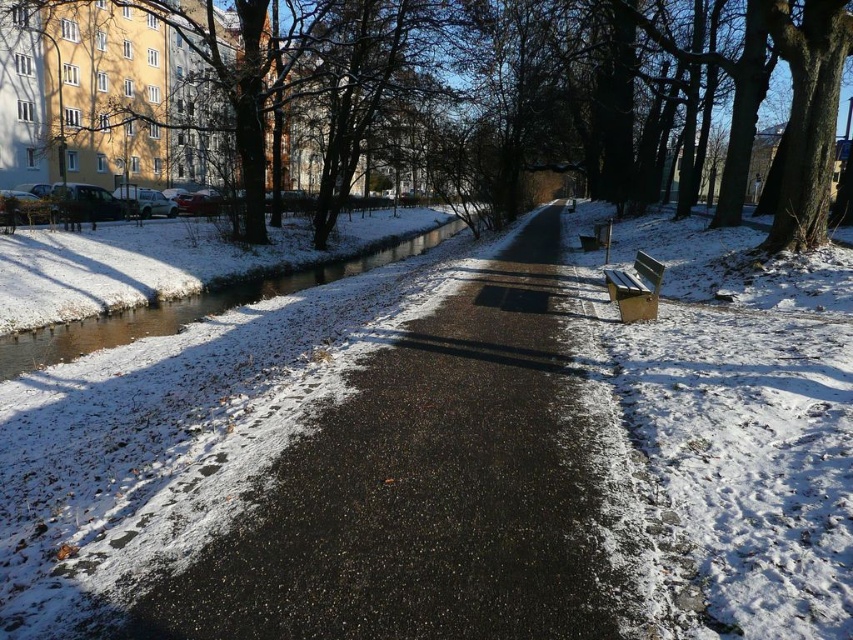
Does black asphalt path at center appear on the left side of brown/ice waterway at center-left?

Incorrect, black asphalt path at center is not on the left side of brown/ice waterway at center-left.

Who is lower down, black asphalt path at center or brown/ice waterway at center-left?

black asphalt path at center

This screenshot has height=640, width=853. I want to click on black asphalt path at center, so click(424, 490).

Which is in front, point (786, 148) or point (654, 314)?

Positioned in front is point (654, 314).

In order to click on brown textured tree at center in this screenshot , I will do `click(514, 93)`.

Can you confirm if brown textured tree at center is thinner than brown/ice waterway at center-left?

No, brown textured tree at center is not thinner than brown/ice waterway at center-left.

Measure the distance between brown textured tree at center and brown/ice waterway at center-left.

12.34 meters

The height and width of the screenshot is (640, 853). What do you see at coordinates (514, 93) in the screenshot? I see `brown textured tree at center` at bounding box center [514, 93].

I want to click on brown textured tree at center, so point(514,93).